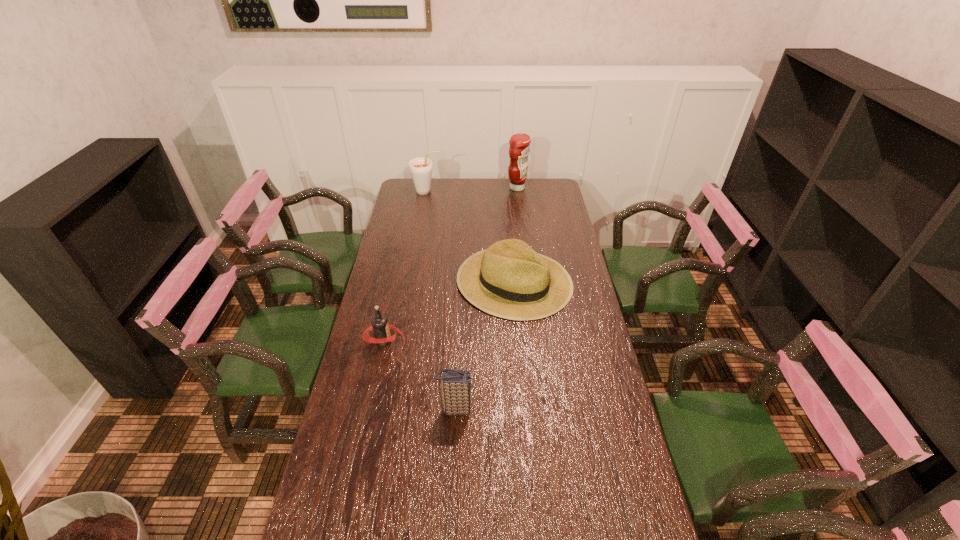
Locate an element on the screen. This screenshot has width=960, height=540. free space located 0.370m on the label of the shorter root beer is located at coordinates (510, 341).

The width and height of the screenshot is (960, 540). Identify the location of free region located 0.370m on the front of the third nearest object. (526, 410).

The height and width of the screenshot is (540, 960). What are the coordinates of `condiment that is at the far edge` in the screenshot? It's located at (519, 149).

This screenshot has height=540, width=960. Find the location of `root beer positioned at the far edge`. root beer positioned at the far edge is located at coordinates (420, 167).

At what (x,y) coordinates should I click in order to perform the action: click on object that is positioned at the right edge. Please return your answer as a coordinate pair (x, y). The width and height of the screenshot is (960, 540). Looking at the image, I should click on (510, 280).

Where is `object that is at the far left corner`? object that is at the far left corner is located at coordinates (420, 167).

In the image, there is a desktop. Where is `free space at the far edge`? This screenshot has width=960, height=540. free space at the far edge is located at coordinates (432, 201).

In order to click on vacant space at the left edge in this screenshot , I will do `click(329, 503)`.

Find the location of a particular element. vacant space at the right edge is located at coordinates (572, 323).

The width and height of the screenshot is (960, 540). In the image, there is a desktop. Find the location of `vacant space at the far left corner`. vacant space at the far left corner is located at coordinates (427, 200).